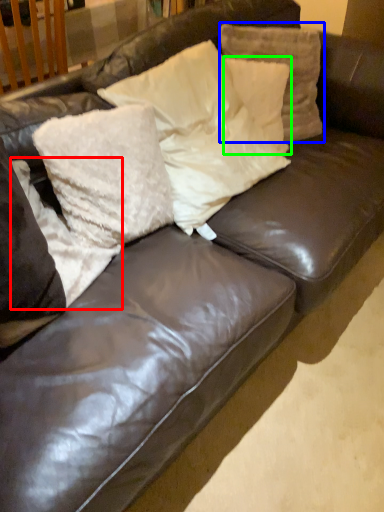
Question: Considering the real-world distances, which object is closest to pillow (highlighted by a red box)? pillow (highlighted by a blue box) or pillow (highlighted by a green box).

Choices:
 (A) pillow
 (B) pillow

Answer: (B)